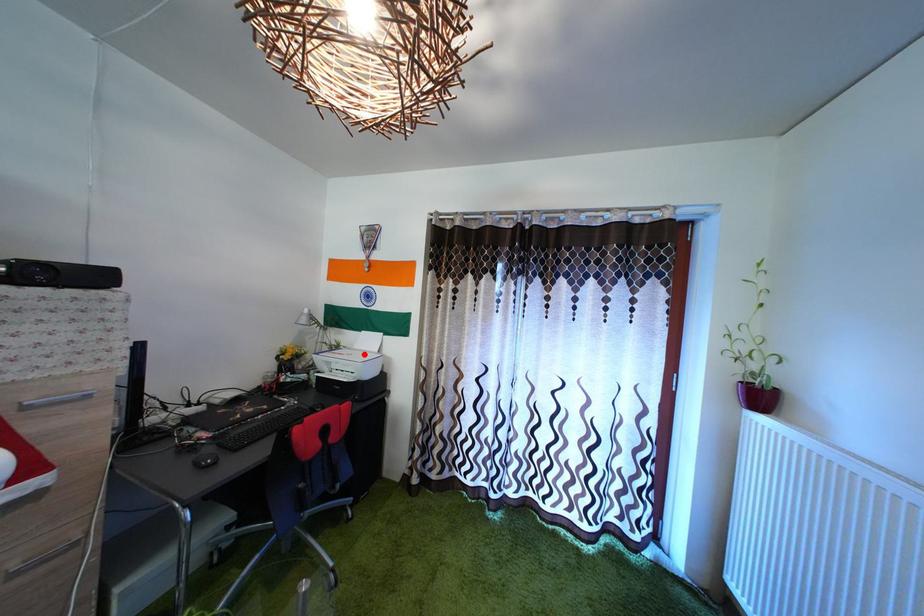
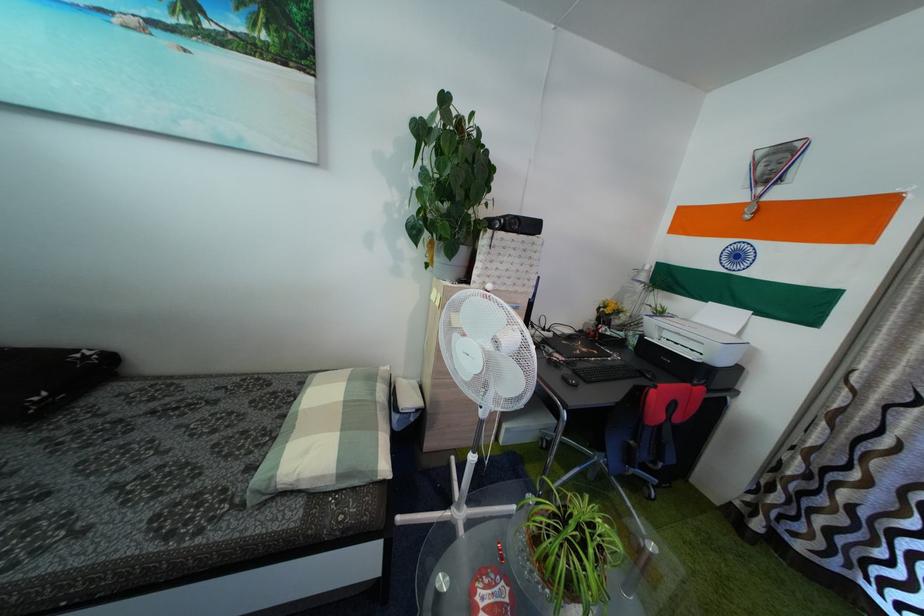
Question: I am providing you with two images of the same scene from different viewpoints. In image1, a red point is highlighted. Considering the same 3D point in image2, which of the following is correct?

Choices:
 (A) It is closer
 (B) It is farther

Answer: (A)